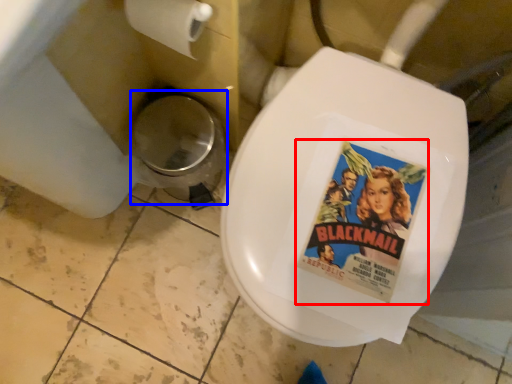
Question: Among these objects, which one is nearest to the camera, movie poster (highlighted by a red box) or potty (highlighted by a blue box)?

Choices:
 (A) movie poster
 (B) potty

Answer: (A)